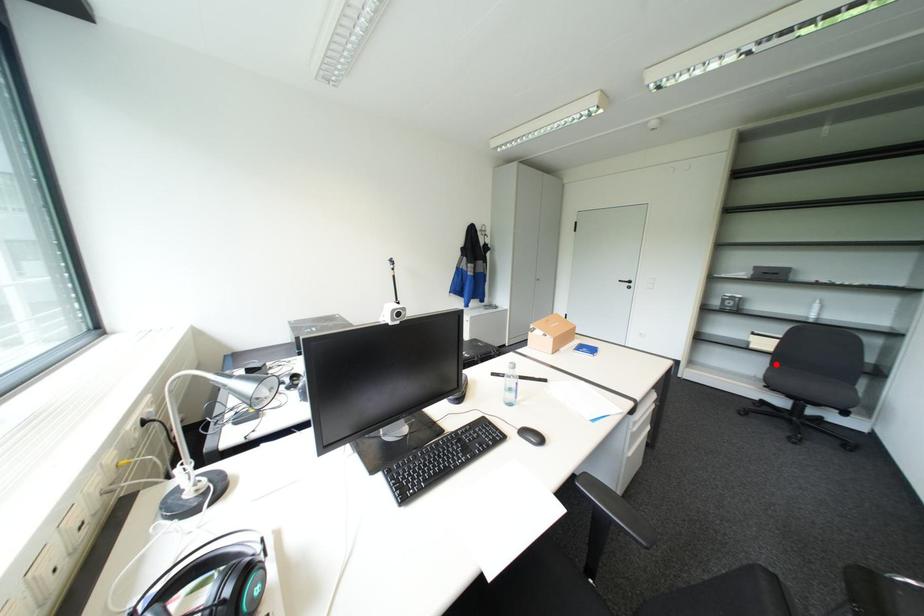
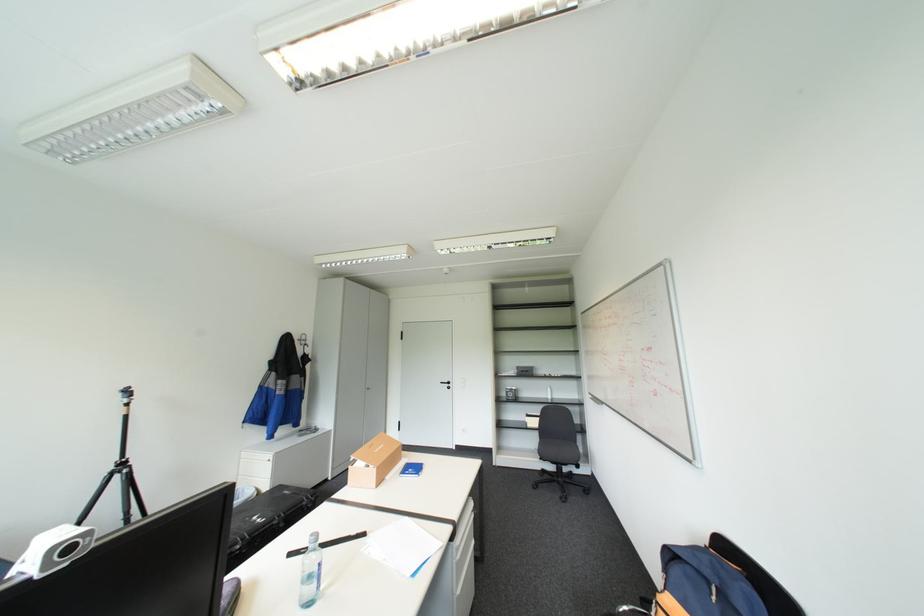
In the second image, find the point that corresponds to the highlighted location in the first image.

(546, 438)